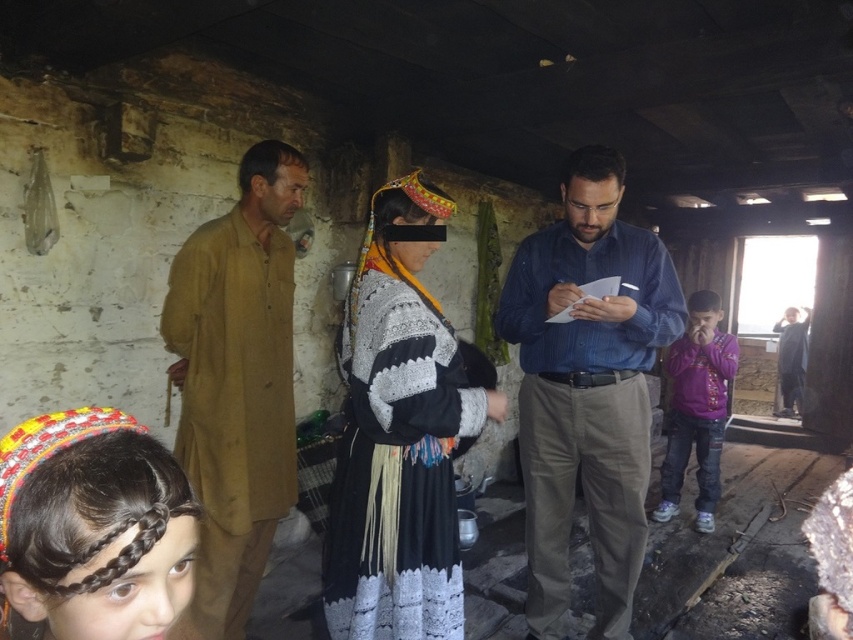
You are standing in the rustic setting and want to place a small decoration exactly at the point with coordinates [585,388]. According to the image, where should you place the decoration?

The point with coordinates [585,388] is on the blue striped shirt at center, so you should place the decoration on the blue striped shirt at center.

You are a photographer setting up a shot in this scene. You want to ensure that the knitted woolen dress at center and the dark brown braided hair at lower left are both visible in the frame. Which object should you prioritize positioning closer to the camera to avoid being cut off?

The dark brown braided hair at lower left should be positioned closer to the camera because it is narrower than the knitted woolen dress at center, making it easier to fit within the frame without being cut off.